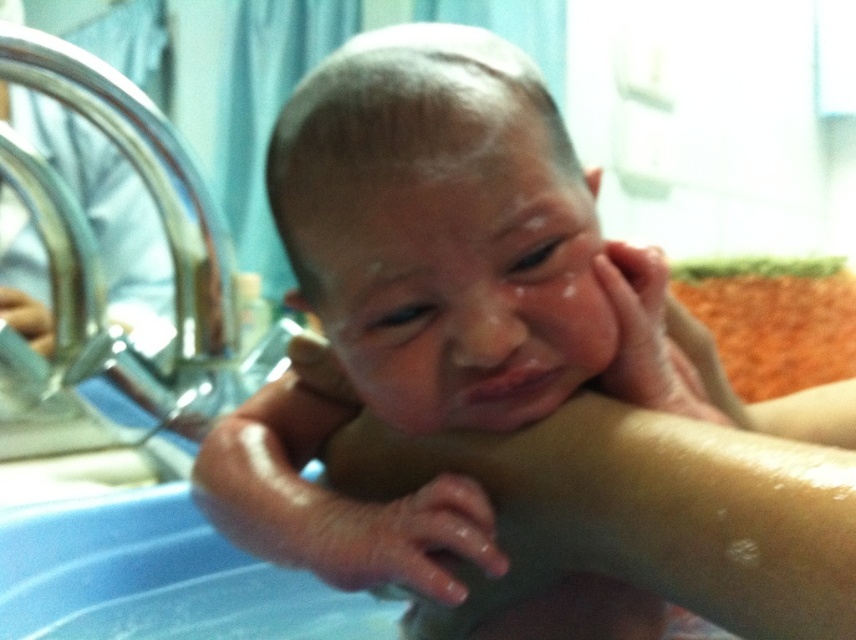
You are a caregiver observing the baby in the bath. You notice the chrome metallic faucet at left and the dry skin hand at center. Which object is closer to you from your viewpoint?

The dry skin hand at center is behind the chrome metallic faucet at left, so the faucet is closer to you.

Based on the photo, you are a photographer taking a photo of the baby in the blue plastic tub. You notice two points in the image labeled as point 1 at coordinates point 1 at coordinates point (446,545) and point 2 at coordinates point (6,316). Which point is closer to the camera?

Point (446,545) is closer to the camera than point (6,316).

In the scene where a baby is being bathed in a blue plastic tub, there is a point labeled as point (161, 221). What object does this point correspond to?

The point corresponds to the chrome metallic faucet at left.